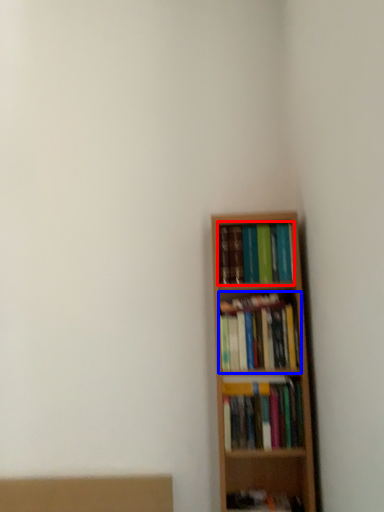
Question: Among these objects, which one is nearest to the camera, book (highlighted by a red box) or book (highlighted by a blue box)?

Choices:
 (A) book
 (B) book

Answer: (B)